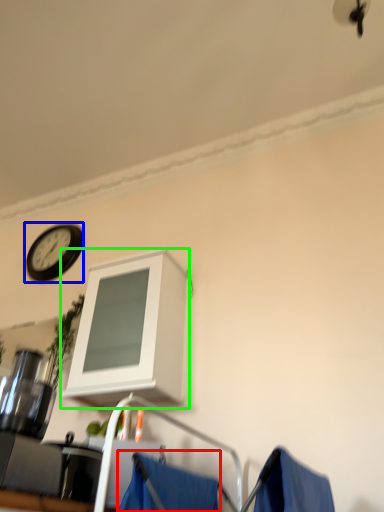
Question: Which object is positioned closest to curtain (highlighted by a red box)? Select from wall clock (highlighted by a blue box) and cabinetry (highlighted by a green box).

Choices:
 (A) wall clock
 (B) cabinetry

Answer: (B)